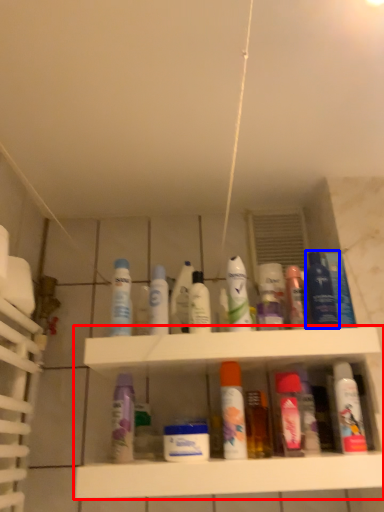
Question: Which object is further to the camera taking this photo, shelf (highlighted by a red box) or mouthwash (highlighted by a blue box)?

Choices:
 (A) shelf
 (B) mouthwash

Answer: (B)